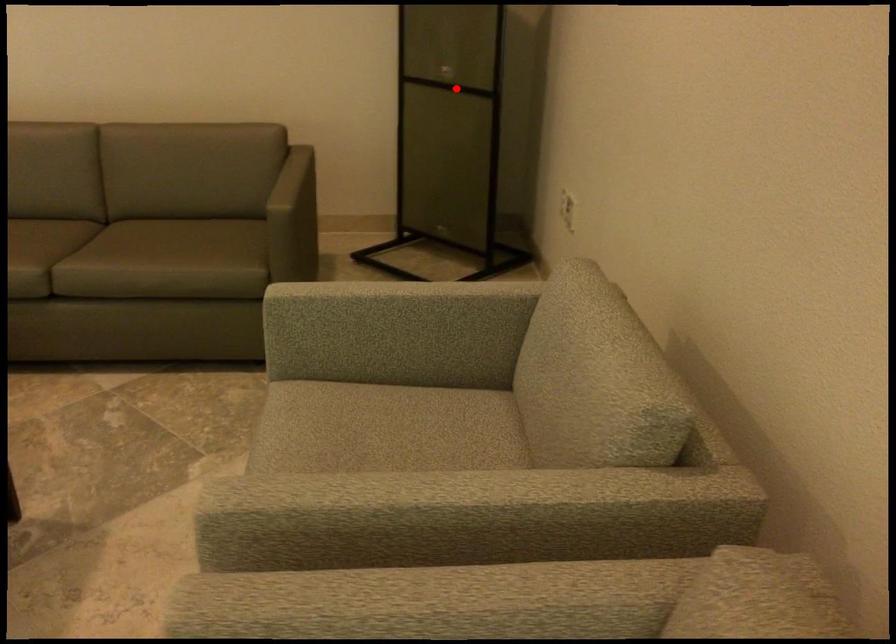
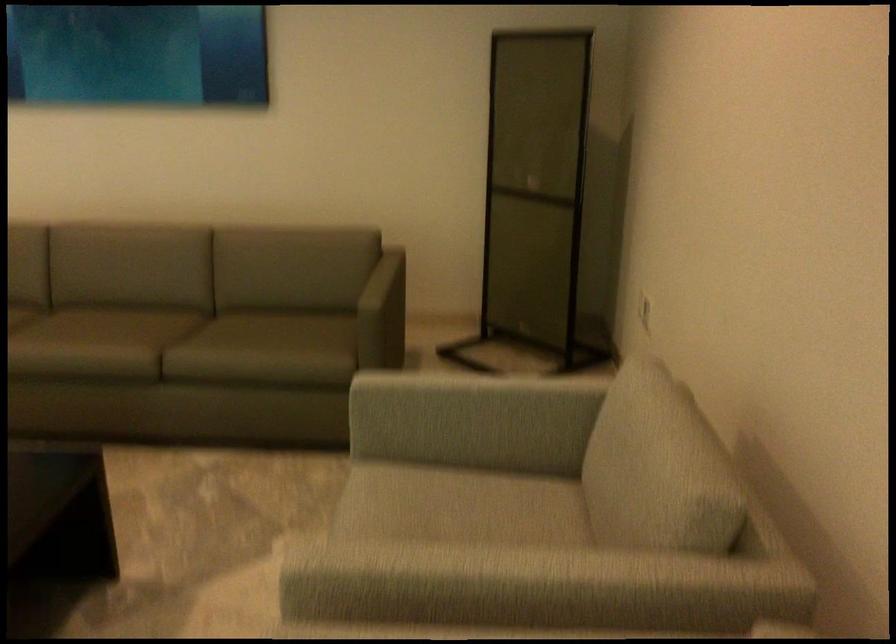
Where in the second image is the point corresponding to the highlighted location from the first image?

(536, 194)